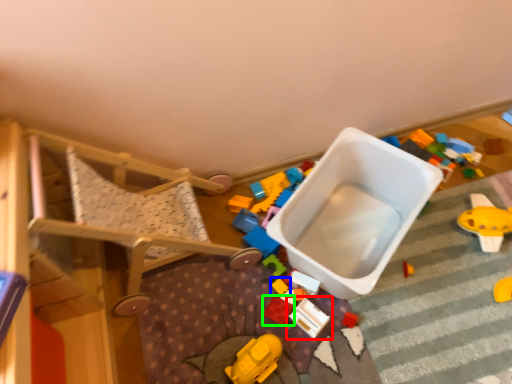
Question: Which object is the farthest from toy (highlighted by a red box)? Choose among these: toy (highlighted by a blue box) or toy (highlighted by a green box).

Choices:
 (A) toy
 (B) toy

Answer: (A)